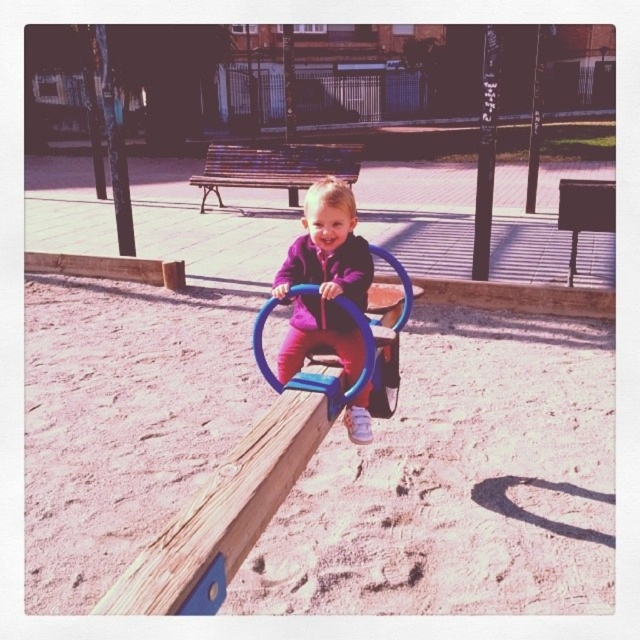
Is purple fleece jacket at center bigger than blue plastic swing at center?

Incorrect, purple fleece jacket at center is not larger than blue plastic swing at center.

Locate an element on the screen. purple fleece jacket at center is located at coordinates (324, 280).

Find the location of a particular element. purple fleece jacket at center is located at coordinates (324, 280).

Is the position of smooth sand at center less distant than that of blue plastic swing at center?

No, smooth sand at center is behind blue plastic swing at center.

Between point (429, 413) and point (392, 314), which one is positioned behind?

The point (429, 413) is behind.

This screenshot has width=640, height=640. In order to click on smooth sand at center in this screenshot , I will do `click(460, 483)`.

Measure the distance between smooth sand at center and purple fleece jacket at center.

They are 3.31 feet apart.

Is smooth sand at center shorter than purple fleece jacket at center?

Yes, smooth sand at center is shorter than purple fleece jacket at center.

What do you see at coordinates (460, 483) in the screenshot?
I see `smooth sand at center` at bounding box center [460, 483].

Find the location of a particular element. smooth sand at center is located at coordinates (460, 483).